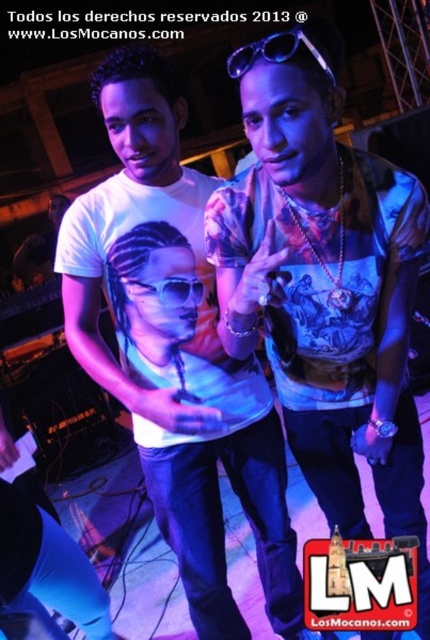
You are a photographer at a concert. You need to capture a photo of the printed cotton shirt at center and transparent plastic goggles at center. Which object should you focus on first if you want to ensure both are in the frame without moving the camera?

The printed cotton shirt at center has a greater height compared to transparent plastic goggles at center, so you should focus on the printed cotton shirt at center first to ensure both are in the frame without moving the camera.